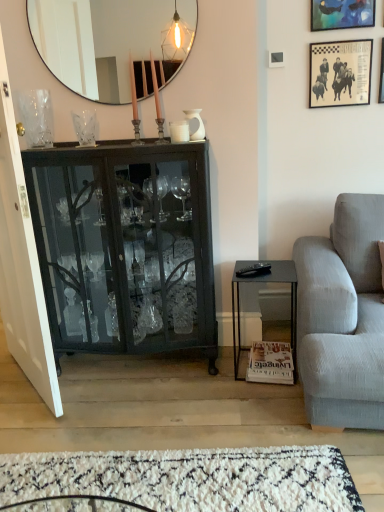
Find the location of `free spot in front of clear glass vase at upper center, the 2th vase when ordered from right to left`. free spot in front of clear glass vase at upper center, the 2th vase when ordered from right to left is located at coordinates (79, 151).